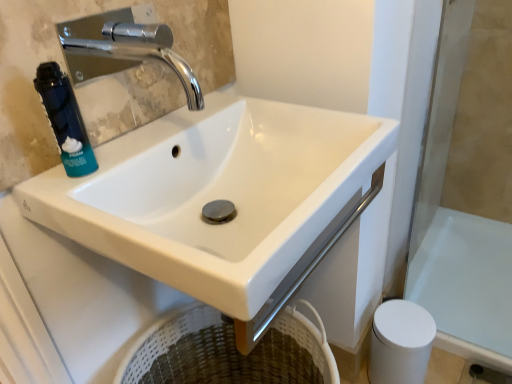
Question: Is white glossy bath at lower right wider or thinner than chrome metallic faucet at upper left?

Choices:
 (A) wide
 (B) thin

Answer: (A)

Question: Considering the relative positions of white glossy bath at lower right and chrome metallic faucet at upper left in the image provided, is white glossy bath at lower right to the left or to the right of chrome metallic faucet at upper left?

Choices:
 (A) right
 (B) left

Answer: (A)

Question: Which object is positioned farthest from the white matte toilet paper at lower right?

Choices:
 (A) white glossy bath at lower right
 (B) blue matte foam canister at left
 (C) white glossy sink at center
 (D) chrome metallic faucet at upper left

Answer: (D)

Question: Which object is the farthest from the white glossy bath at lower right?

Choices:
 (A) white matte toilet paper at lower right
 (B) chrome metallic faucet at upper left
 (C) blue matte foam canister at left
 (D) white glossy sink at center

Answer: (B)